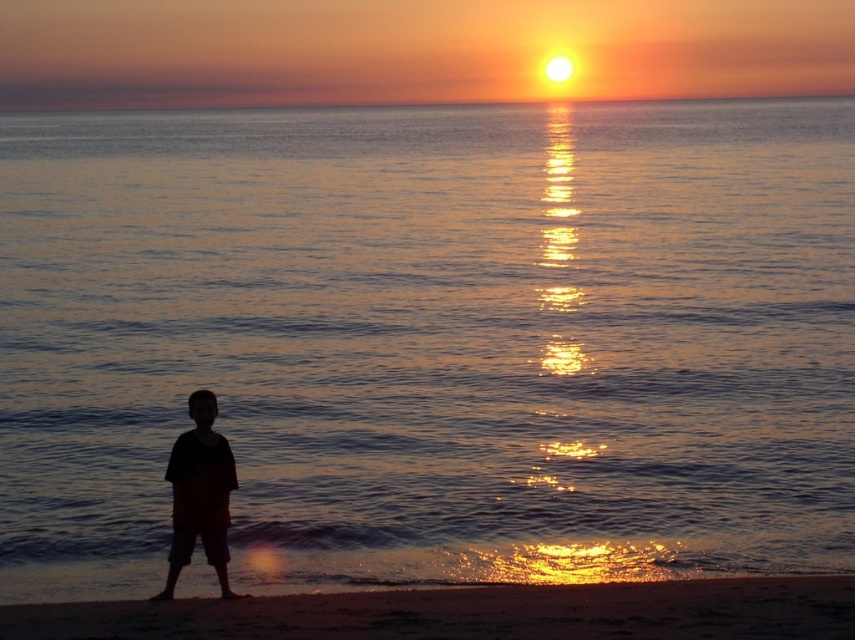
You are standing on the beach and see the silhouette fabric shorts at lower left and the sandy beach at lower center. Which object is positioned to the right of the other?

The sandy beach at lower center is positioned to the right of the silhouette fabric shorts at lower left.